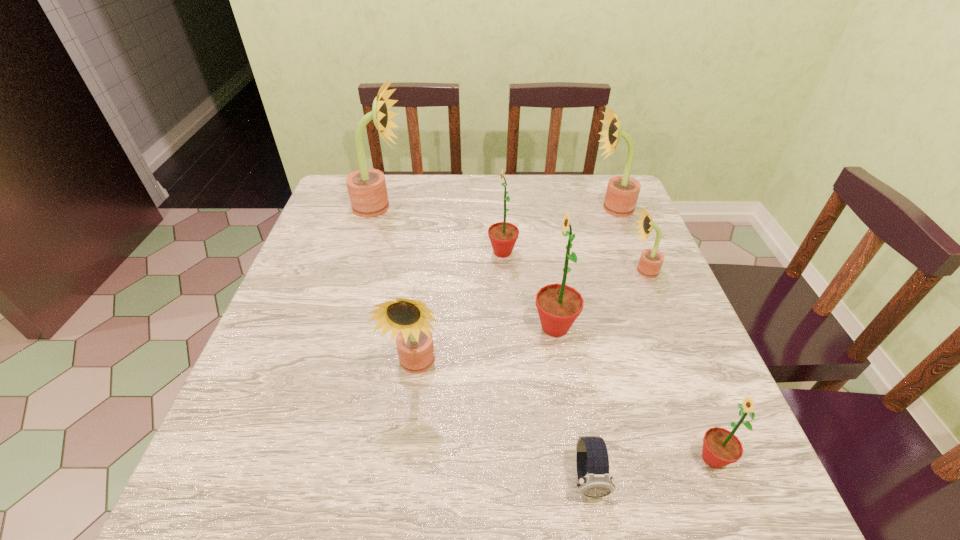
Image resolution: width=960 pixels, height=540 pixels. I want to click on blank area located on the face of the nearest sunflower, so click(x=570, y=458).

This screenshot has width=960, height=540. I want to click on sunflower present at the near edge, so [721, 447].

This screenshot has height=540, width=960. Find the location of `watch that is at the near edge`. watch that is at the near edge is located at coordinates pos(592,460).

Locate an element on the screen. Image resolution: width=960 pixels, height=540 pixels. object that is at the left edge is located at coordinates (367, 189).

Find the location of `object that is positioned at the far left corner`. object that is positioned at the far left corner is located at coordinates (367, 189).

Locate an element on the screen. Image resolution: width=960 pixels, height=540 pixels. object positioned at the far right corner is located at coordinates (622, 192).

At what (x,y) coordinates should I click in order to perform the action: click on object at the near right corner. Please return your answer as a coordinate pair (x, y). This screenshot has width=960, height=540. Looking at the image, I should click on (721, 447).

In the image, there is a desktop. In order to click on free space at the far edge in this screenshot , I will do `click(410, 201)`.

Where is `vacant space at the near edge of the desktop`? vacant space at the near edge of the desktop is located at coordinates (440, 509).

In the image, there is a desktop. Identify the location of free region at the left edge. (240, 393).